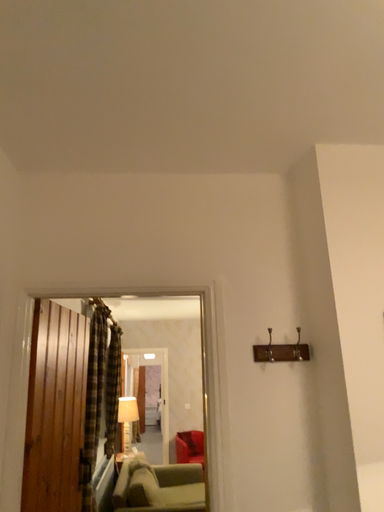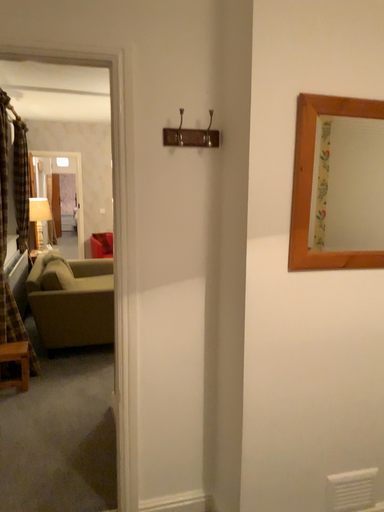
Question: Which way did the camera rotate in the video?

Choices:
 (A) rotated downward
 (B) rotated upward

Answer: (A)